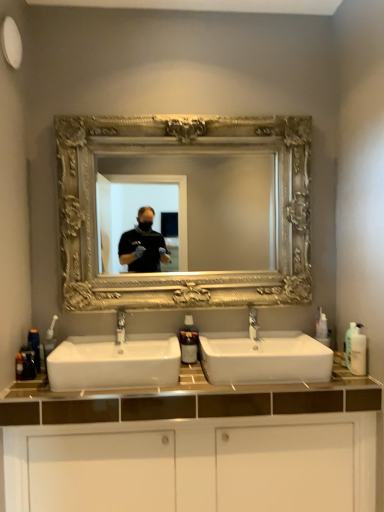
You are a GUI agent. You are given a task and a screenshot of the screen. Output one action in this format:
    pyautogui.click(x=<x>, y=<y>)
    Task: Click on the vacant area in front of blue plastic bottle at lower left, which is the third toiletry from right to left
    
    Given the screenshot: What is the action you would take?
    pos(29,387)